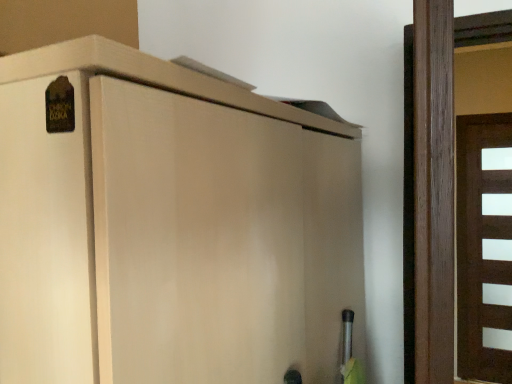
Identify the location of brown matte door at right, the second door viewed from the left. Image resolution: width=512 pixels, height=384 pixels. (481, 247).

Consider the image. What is the approximate width of brown wooden door at right, acting as the 1th door starting from the left?

29.53 inches.

Find the location of a particular element. The image size is (512, 384). brown matte door at right, the second door viewed from the left is located at coordinates (481, 247).

Between matte wood cupboard at upper left and brown matte door at right, the second door viewed from the left, which one has smaller width?

With smaller width is brown matte door at right, the second door viewed from the left.

How many degrees apart are the facing directions of matte wood cupboard at upper left and brown matte door at right, the 1th door positioned from the back?

They differ by 91.5 degrees in their facing directions.

Which of these two, matte wood cupboard at upper left or brown matte door at right, the 2th door when ordered from front to back, stands shorter?

With less height is matte wood cupboard at upper left.

Consider the image. From the image's perspective, is matte wood cupboard at upper left located above or below brown matte door at right, placed as the 1th door when sorted from right to left?

matte wood cupboard at upper left is situated higher than brown matte door at right, placed as the 1th door when sorted from right to left, in the image.

From the image's perspective, is matte wood cupboard at upper left on top of brown wooden door at right, arranged as the 1th door when viewed from the front?

No, from the image's perspective, matte wood cupboard at upper left is not above brown wooden door at right, arranged as the 1th door when viewed from the front.

Would you say matte wood cupboard at upper left is to the left or to the right of brown wooden door at right, arranged as the 1th door when viewed from the front, in the picture?

Based on their positions, matte wood cupboard at upper left is located to the left of brown wooden door at right, arranged as the 1th door when viewed from the front.

From a real-world perspective, is matte wood cupboard at upper left over brown wooden door at right, arranged as the 1th door when viewed from the front?

No, from a real-world perspective, matte wood cupboard at upper left is not above brown wooden door at right, arranged as the 1th door when viewed from the front.

In terms of width, does matte wood cupboard at upper left look wider or thinner when compared to brown wooden door at right, which is counted as the 2th door, starting from the right?

In the image, matte wood cupboard at upper left appears to be more narrow than brown wooden door at right, which is counted as the 2th door, starting from the right.

Considering the sizes of brown wooden door at right, acting as the 1th door starting from the left, and matte wood cupboard at upper left in the image, is brown wooden door at right, acting as the 1th door starting from the left, taller or shorter than matte wood cupboard at upper left?

Considering their sizes, brown wooden door at right, acting as the 1th door starting from the left, has more height than matte wood cupboard at upper left.

Is brown wooden door at right, arranged as the 1th door when viewed from the front, oriented towards matte wood cupboard at upper left?

No, brown wooden door at right, arranged as the 1th door when viewed from the front, is not facing towards matte wood cupboard at upper left.

Is brown wooden door at right, which is counted as the 2th door, starting from the right, beside matte wood cupboard at upper left?

No.

Could matte wood cupboard at upper left be considered to be inside brown wooden door at right, the second door when ordered from back to front?

No, brown wooden door at right, the second door when ordered from back to front, does not contain matte wood cupboard at upper left.

Is brown wooden door at right, the second door when ordered from back to front, located outside brown matte door at right, the second door viewed from the left?

Yes, brown wooden door at right, the second door when ordered from back to front, is not within brown matte door at right, the second door viewed from the left.

Does point (419, 290) come behind point (507, 368)?

No, (419, 290) is in front of (507, 368).

Does brown wooden door at right, arranged as the 1th door when viewed from the front, appear on the right side of brown matte door at right, the second door viewed from the left?

In fact, brown wooden door at right, arranged as the 1th door when viewed from the front, is to the left of brown matte door at right, the second door viewed from the left.

Could you tell me if brown wooden door at right, the second door when ordered from back to front, is turned towards brown matte door at right, the 1th door positioned from the back?

No, brown wooden door at right, the second door when ordered from back to front, is not aimed at brown matte door at right, the 1th door positioned from the back.

From a real-world perspective, between brown matte door at right, the second door viewed from the left, and brown wooden door at right, which is counted as the 2th door, starting from the right, who is vertically lower?

brown matte door at right, the second door viewed from the left, is physically lower.

Does brown matte door at right, the 2th door when ordered from front to back, touch brown wooden door at right, acting as the 1th door starting from the left?

No.

In terms of width, does brown matte door at right, the 1th door positioned from the back, look wider or thinner when compared to brown wooden door at right, the second door when ordered from back to front?

Clearly, brown matte door at right, the 1th door positioned from the back, has less width compared to brown wooden door at right, the second door when ordered from back to front.

Would you say brown wooden door at right, arranged as the 1th door when viewed from the front, is part of brown matte door at right, the second door viewed from the left,'s contents?

No, brown wooden door at right, arranged as the 1th door when viewed from the front, is not inside brown matte door at right, the second door viewed from the left.

Locate an element on the screen. cupboard positioned vertically above the brown matte door at right, the 2th door when ordered from front to back (from a real-world perspective) is located at coordinates (169, 225).

From a real-world perspective, which is physically below, brown matte door at right, the 2th door when ordered from front to back, or matte wood cupboard at upper left?

brown matte door at right, the 2th door when ordered from front to back.

Is point (499, 268) in front of point (127, 190)?

No, (499, 268) is further to viewer.

What's the angular difference between brown matte door at right, the 1th door positioned from the back, and matte wood cupboard at upper left's facing directions?

The angular difference between brown matte door at right, the 1th door positioned from the back, and matte wood cupboard at upper left is 91.5 degrees.

Locate an element on the screen. The height and width of the screenshot is (384, 512). the 2nd door counting from the right side of the matte wood cupboard at upper left is located at coordinates (481, 247).

Where is `the 1st door behind the matte wood cupboard at upper left, starting your count from the anchor`? Image resolution: width=512 pixels, height=384 pixels. the 1st door behind the matte wood cupboard at upper left, starting your count from the anchor is located at coordinates (426, 209).

Looking at the image, which one is located closer to brown matte door at right, the 1th door positioned from the back, matte wood cupboard at upper left or brown wooden door at right, acting as the 1th door starting from the left?

brown wooden door at right, acting as the 1th door starting from the left, is positioned closer to the anchor brown matte door at right, the 1th door positioned from the back.

When comparing their distances from matte wood cupboard at upper left, does brown matte door at right, placed as the 1th door when sorted from right to left, or brown wooden door at right, the second door when ordered from back to front, seem further?

brown matte door at right, placed as the 1th door when sorted from right to left, is further to matte wood cupboard at upper left.

Considering their positions, is matte wood cupboard at upper left positioned closer to brown wooden door at right, the second door when ordered from back to front, than brown matte door at right, the second door viewed from the left?

Among the two, matte wood cupboard at upper left is located nearer to brown wooden door at right, the second door when ordered from back to front.

Based on their spatial positions, is brown wooden door at right, which is counted as the 2th door, starting from the right, or matte wood cupboard at upper left further from brown matte door at right, placed as the 1th door when sorted from right to left?

matte wood cupboard at upper left is positioned further to the anchor brown matte door at right, placed as the 1th door when sorted from right to left.

Looking at this image, based on their spatial positions, is brown wooden door at right, arranged as the 1th door when viewed from the front, or brown matte door at right, the 2th door when ordered from front to back, further from matte wood cupboard at upper left?

Among the two, brown matte door at right, the 2th door when ordered from front to back, is located further to matte wood cupboard at upper left.

When comparing their distances from brown wooden door at right, which is counted as the 2th door, starting from the right, does brown matte door at right, the 2th door when ordered from front to back, or matte wood cupboard at upper left seem further?

Based on the image, brown matte door at right, the 2th door when ordered from front to back, appears to be further to brown wooden door at right, which is counted as the 2th door, starting from the right.

Where is `door between matte wood cupboard at upper left and brown matte door at right, the 2th door when ordered from front to back, along the z-axis`? This screenshot has height=384, width=512. door between matte wood cupboard at upper left and brown matte door at right, the 2th door when ordered from front to back, along the z-axis is located at coordinates (426, 209).